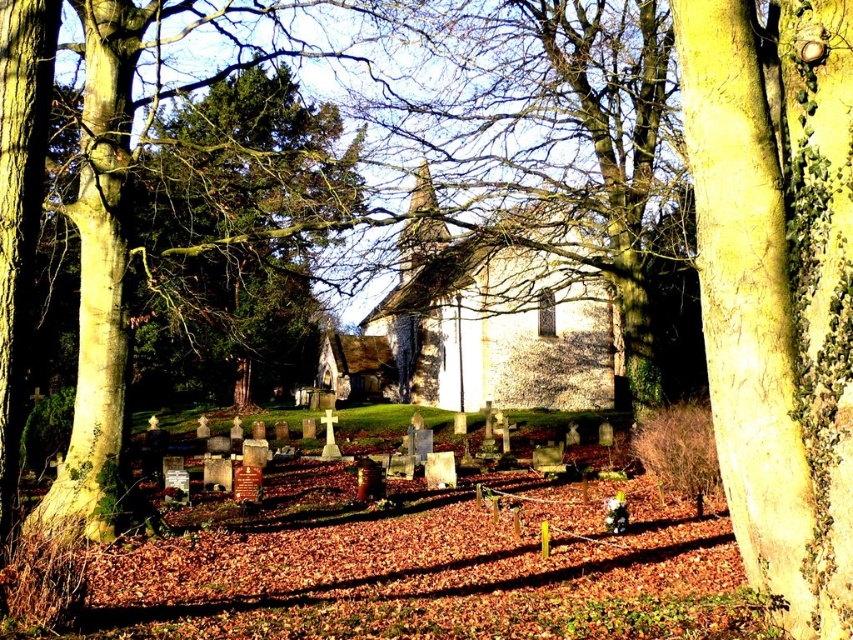
You are standing in the cemetery and want to walk from the point closer to you to the point further away. Which path would you take between the two points, point (793, 616) and point (612, 115)?

The path from point (793, 616) to point (612, 115) would involve moving away from the viewer since point (793, 616) is closer to the viewer than point (612, 115).

You are standing in the cemetery and want to place a small flowerpot between the green rough bark tree at right and the smooth bark tree at center. According to their positions, which tree should the flowerpot be closer to?

The green rough bark tree at right is to the left of the smooth bark tree at center, so the flowerpot should be placed closer to the smooth bark tree at center since it is on the right side of the green rough bark tree at right.

You are standing at the center of the cemetery and notice a point marked at coordinates (776,289). Which object in the scene does this point correspond to?

The point corresponds to the green rough bark tree at right.